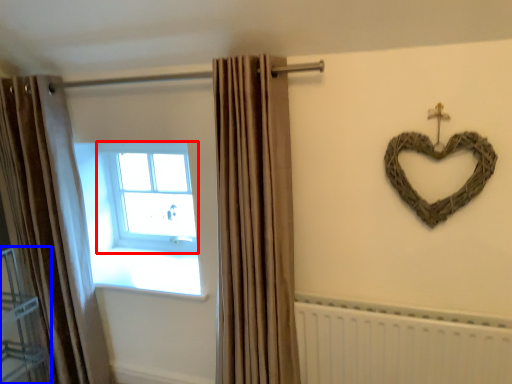
Question: Which of the following is the farthest to the observer, window (highlighted by a red box) or shelf (highlighted by a blue box)?

Choices:
 (A) window
 (B) shelf

Answer: (A)